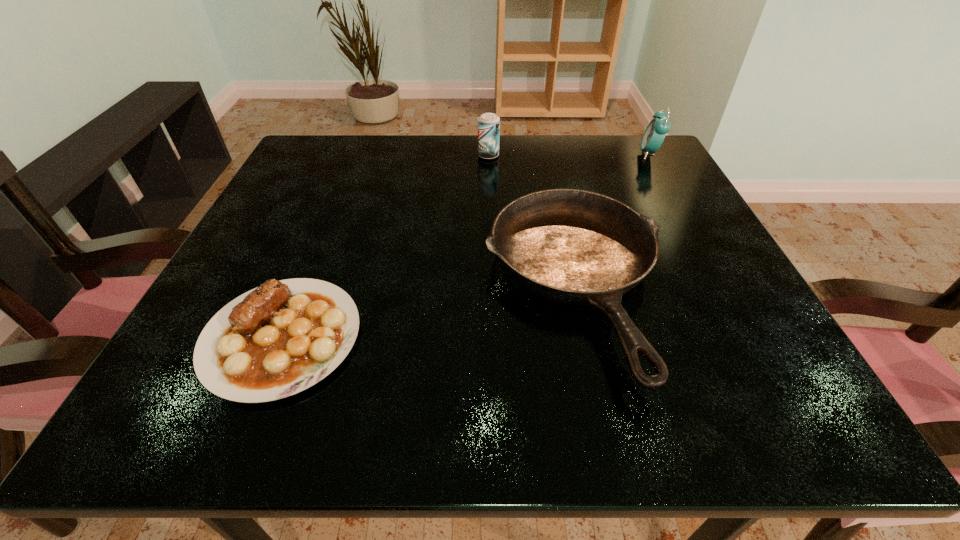
Where is `alarm clock`? The width and height of the screenshot is (960, 540). alarm clock is located at coordinates point(654,135).

You are a GUI agent. You are given a task and a screenshot of the screen. Output one action in this format:
    pyautogui.click(x=<x>, y=<y>)
    Task: Click on the beer can
    The width and height of the screenshot is (960, 540).
    Given the screenshot: What is the action you would take?
    pyautogui.click(x=488, y=123)

The height and width of the screenshot is (540, 960). In order to click on frying pan in this screenshot , I will do `click(576, 247)`.

The image size is (960, 540). I want to click on the leftmost object, so click(x=276, y=340).

Locate an element on the screen. steak is located at coordinates (276, 340).

You are a GUI agent. You are given a task and a screenshot of the screen. Output one action in this format:
    pyautogui.click(x=<x>, y=<y>)
    Task: Click on the vacant area situated 0.380m on the face of the rightmost object
    The image size is (960, 540).
    Given the screenshot: What is the action you would take?
    pyautogui.click(x=483, y=154)

Locate an element on the screen. vacant space located on the face of the rightmost object is located at coordinates (589, 154).

At what (x,y) coordinates should I click in order to perform the action: click on vacant region located on the face of the rightmost object. Please return your answer as a coordinate pair (x, y). Looking at the image, I should click on (557, 154).

I want to click on vacant area situated 0.350m on the left of the beer can, so click(334, 156).

Image resolution: width=960 pixels, height=540 pixels. I want to click on blank space located 0.230m on the left of the frying pan, so click(350, 287).